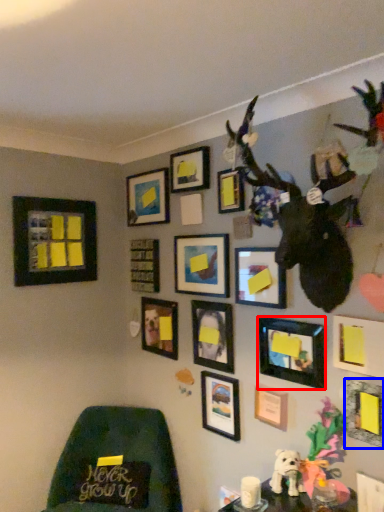
Question: Which object is further to the camera taking this photo, picture frame (highlighted by a red box) or picture frame (highlighted by a blue box)?

Choices:
 (A) picture frame
 (B) picture frame

Answer: (A)